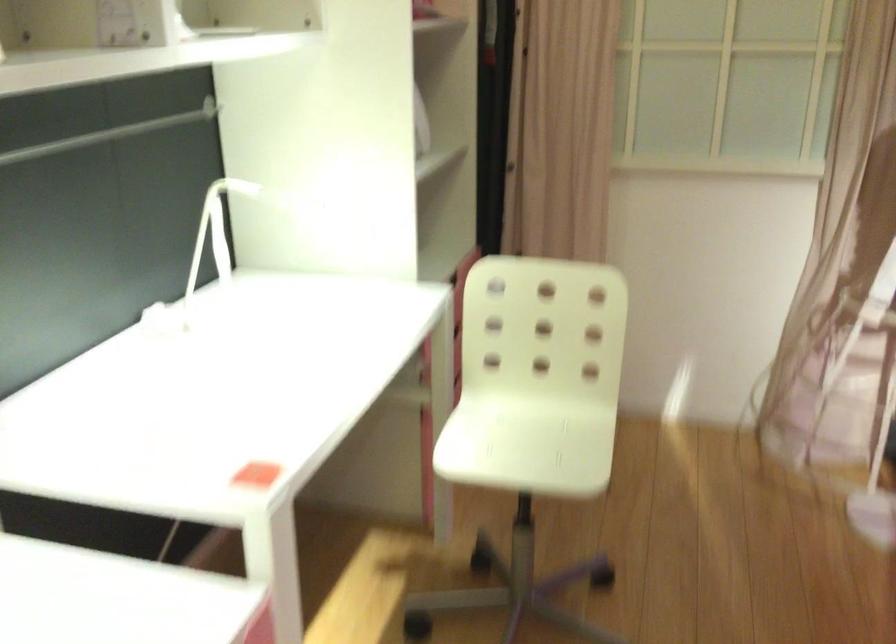
Based on the continuous images, in which direction is the camera rotating?

The camera's rotation is toward left-down.